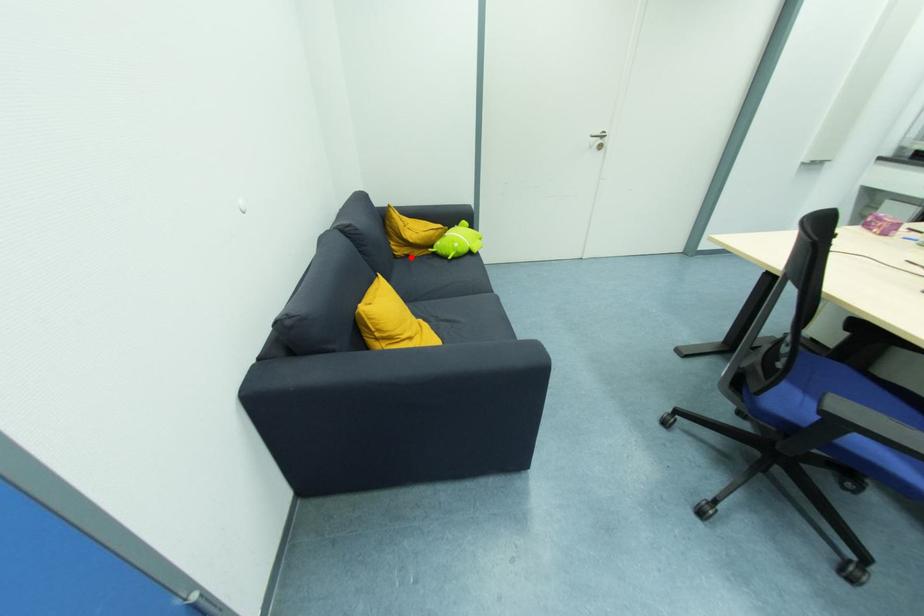
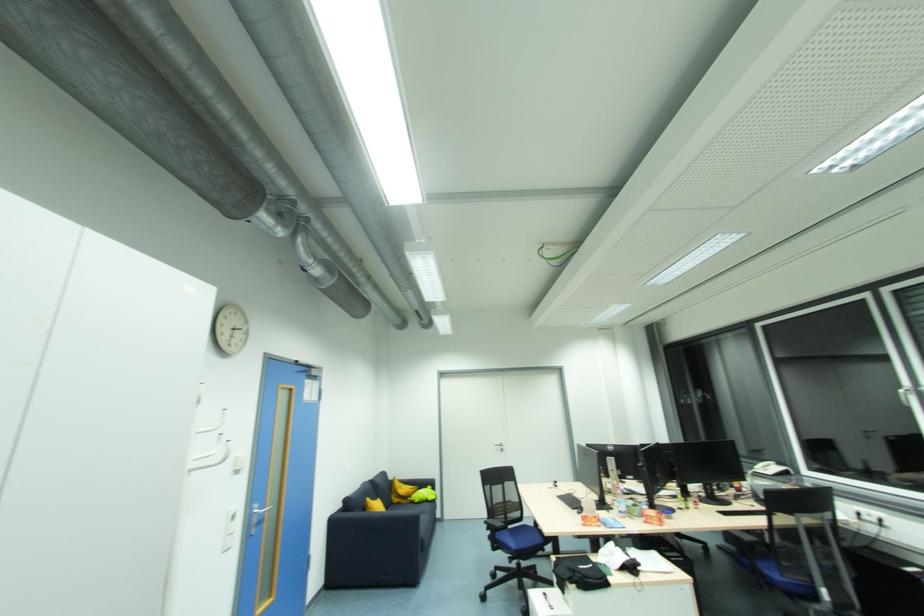
Question: I am providing you with two images of the same scene from different viewpoints. A red point is shown in image1. For the corresponding object point in image2, is it positioned nearer or farther from the camera?

Choices:
 (A) Nearer
 (B) Farther

Answer: (B)